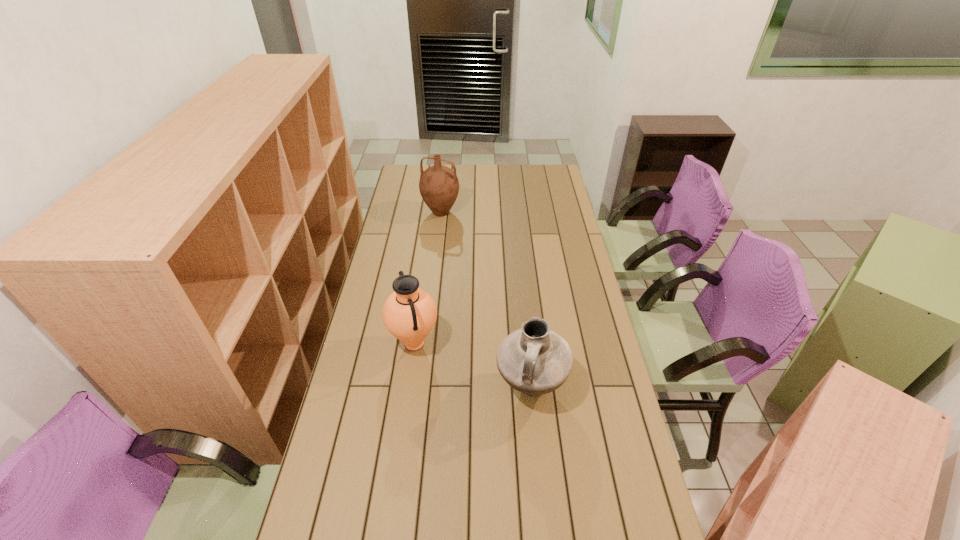
Locate an element on the screen. The image size is (960, 540). the farthest object is located at coordinates (439, 186).

I want to click on the rightmost pitcher, so click(534, 360).

Locate an element on the screen. Image resolution: width=960 pixels, height=540 pixels. free region located on the front of the farthest pitcher is located at coordinates (434, 272).

I want to click on vacant space located 0.230m on the handle side of the rightmost pitcher, so click(x=541, y=497).

Identify the location of vacant region at the far edge of the desktop. (526, 181).

Find the location of a particular element. This screenshot has width=960, height=540. vacant space at the left edge of the desktop is located at coordinates (398, 222).

In order to click on free space at the right edge in this screenshot , I will do `click(570, 342)`.

The height and width of the screenshot is (540, 960). In the image, there is a desktop. Identify the location of vacant space at the far right corner. (539, 179).

The image size is (960, 540). What are the coordinates of `object that stands as the second closest to the rightmost object` in the screenshot? It's located at (439, 186).

Identify the location of object that is the closest one to the farthest object. Image resolution: width=960 pixels, height=540 pixels. (409, 313).